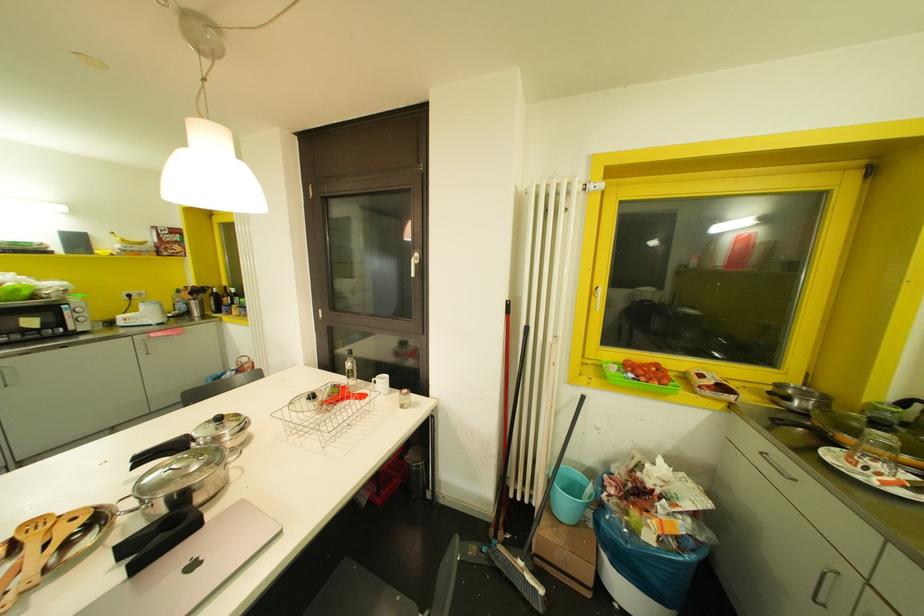
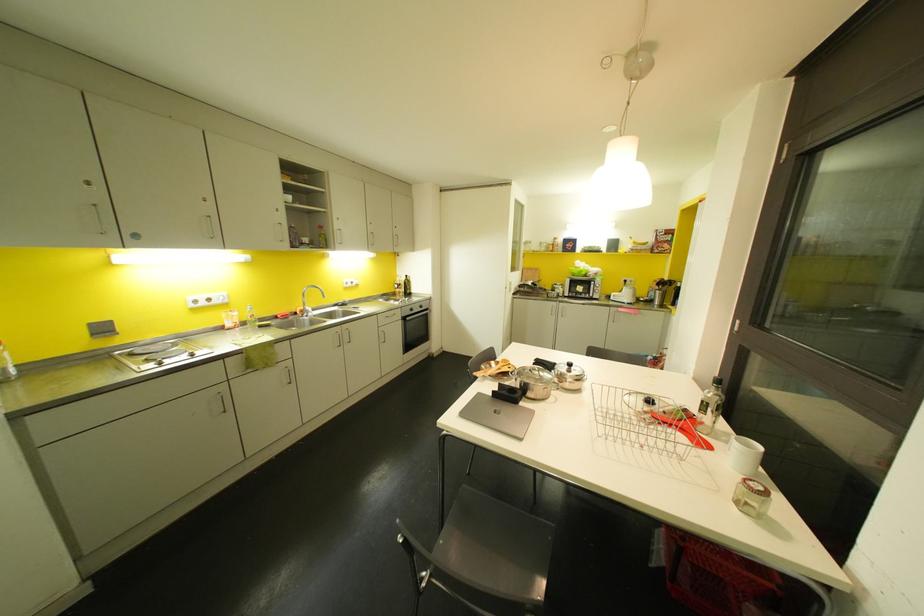
Find the pixel in the second image that matches pixel 219 418 in the first image.

(569, 363)